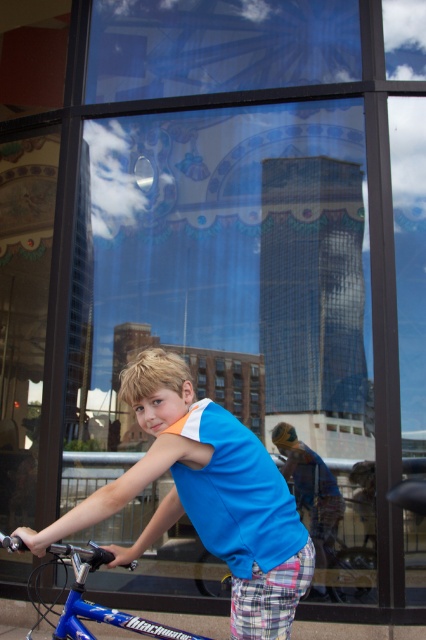
Which of these two, blue cotton shirt at center or blue metallic bicycle at lower left, stands shorter?

blue metallic bicycle at lower left is shorter.

Measure the distance from blue cotton shirt at center to blue metallic bicycle at lower left.

12.42 inches

Which is in front, point (249, 550) or point (149, 630)?

Point (249, 550) is more forward.

The height and width of the screenshot is (640, 426). Identify the location of blue cotton shirt at center. (204, 497).

Between point (276, 513) and point (336, 525), which one is positioned in front?

Point (276, 513) is in front.

Between point (193, 509) and point (359, 563), which one is positioned behind?

Positioned behind is point (359, 563).

Where is `blue cotton shirt at center`? The image size is (426, 640). blue cotton shirt at center is located at coordinates (204, 497).

Which is below, blue metallic bicycle at lower left or blue metallic bicycle at center?

Positioned lower is blue metallic bicycle at center.

Can you confirm if blue metallic bicycle at lower left is shorter than blue metallic bicycle at center?

Yes.

At what (x,y) coordinates should I click in order to perform the action: click on blue metallic bicycle at lower left. Please return your answer as a coordinate pair (x, y). The image size is (426, 640). Looking at the image, I should click on (97, 604).